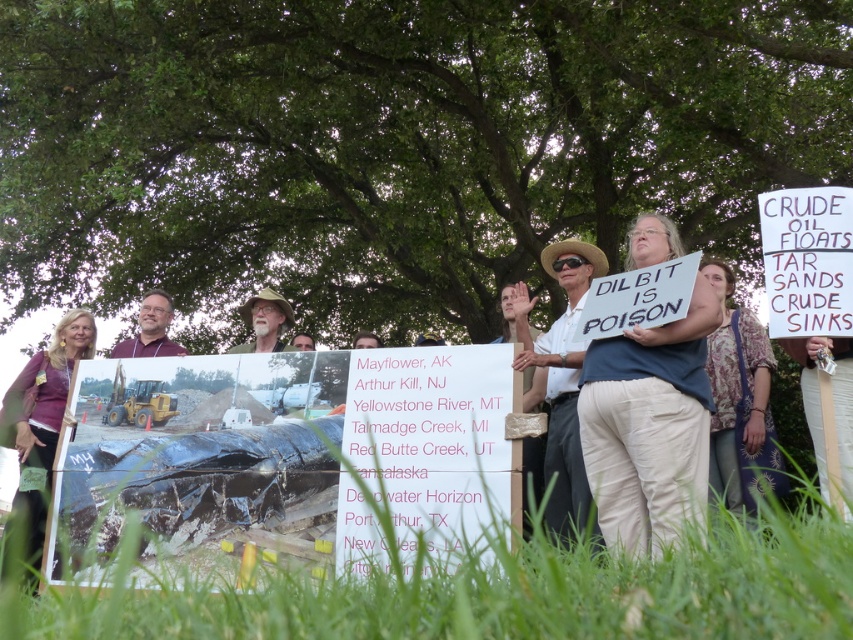
Question: Does white paper sign at center have a greater width compared to matte purple shirt at center?

Choices:
 (A) no
 (B) yes

Answer: (B)

Question: Can you confirm if white cotton shirt at center is positioned below matte purple shirt at center?

Choices:
 (A) no
 (B) yes

Answer: (B)

Question: Which object appears closest to the camera in this image?

Choices:
 (A) purple fabric shirt at center
 (B) white cotton shirt at center

Answer: (B)

Question: Observing the image, what is the correct spatial positioning of white cotton shirt at center in reference to matte purple shirt at center?

Choices:
 (A) below
 (B) above

Answer: (A)

Question: Which point appears farthest from the camera in this image?

Choices:
 (A) (569, 307)
 (B) (142, 340)

Answer: (B)

Question: Which is farther from the green grass at lower center?

Choices:
 (A) purple fabric shirt at center
 (B) floral fabric shirt at upper right

Answer: (A)